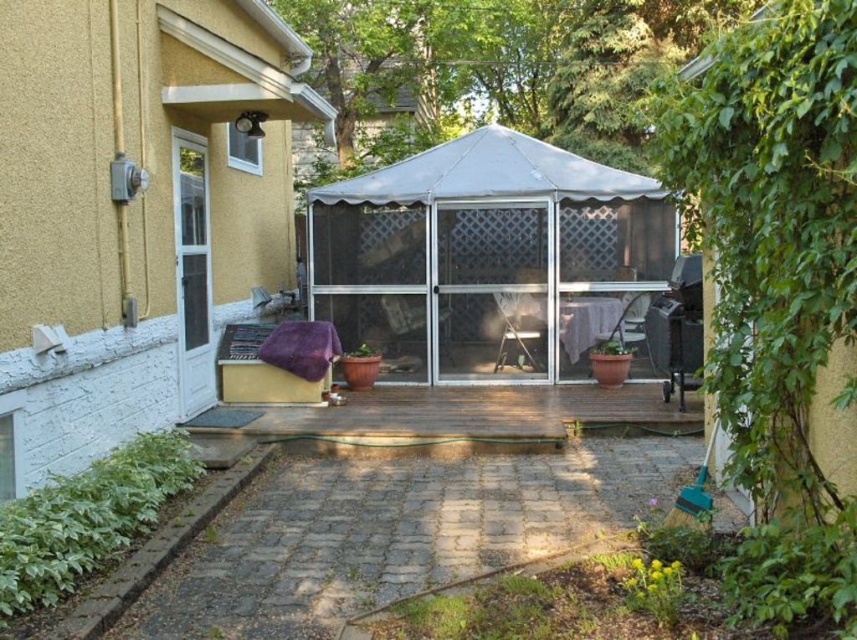
You are standing on the wooden deck at center and want to enter the house through the clear plastic screen door at center. Which direction should you move to reach the door?

Since the wooden deck at center is in front of the clear plastic screen door at center, you should move backward to reach the door.

You are planning to host a dinner party on the wooden deck at center and the white fabric canopy at center. Which object should you set up first if you want to place the canopy over the deck?

The wooden deck at center is to the left of the white fabric canopy at center. To place the canopy over the deck, you should set up the wooden deck at center first, then position the white fabric canopy at center over it.

Looking at this image, you are standing at the entrance of the house and want to take a photo that includes both the point at coordinates point (67,449) and point (187,179). Based on their positions, which point should be placed closer to the front of the photo to ensure both are in focus?

Point (67,449) should be placed closer to the front of the photo because it is closer to the camera than point (187,179). This ensures both points are within the depth of field and in focus.